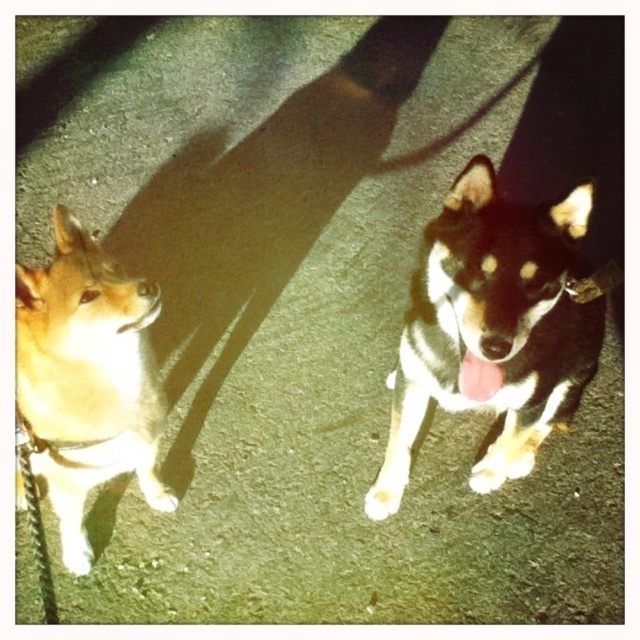
Does black and white fur dog at center appear over light brown fur at left?

Correct, black and white fur dog at center is located above light brown fur at left.

Is point (577, 236) positioned behind point (100, 278)?

No, it is not.

Find the location of `black and white fur dog at center`. black and white fur dog at center is located at coordinates (492, 328).